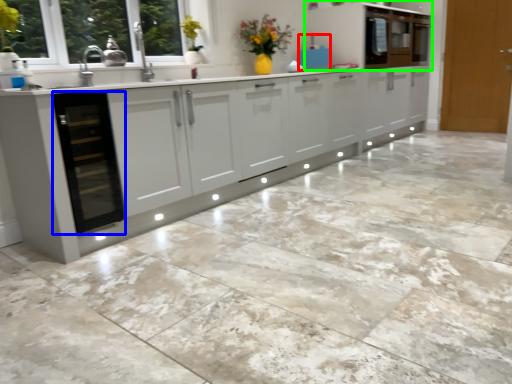
Question: Which is nearer to the appliance (highlighted by a red box)? dish washer (highlighted by a blue box) or cabinetry (highlighted by a green box).

Choices:
 (A) dish washer
 (B) cabinetry

Answer: (B)